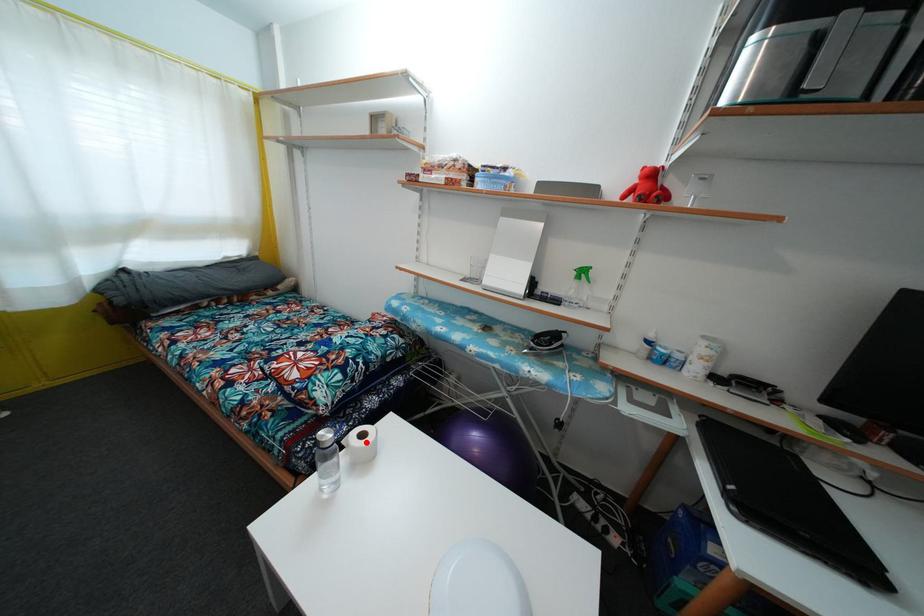
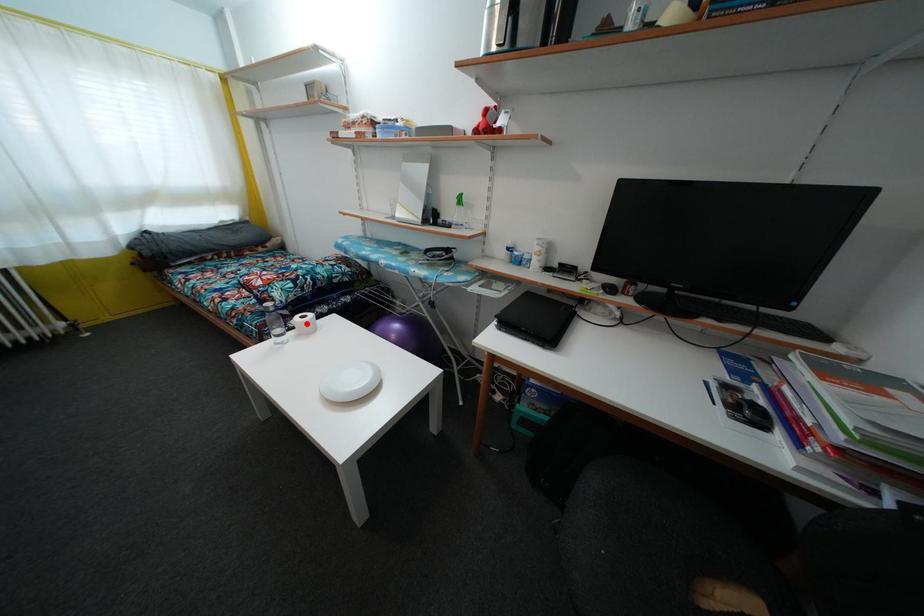
I am providing you with two images of the same scene from different viewpoints. A red point is marked on the first image and another point is marked on the second image. Does the point marked in image1 correspond to the same location as the one in image2?

Yes